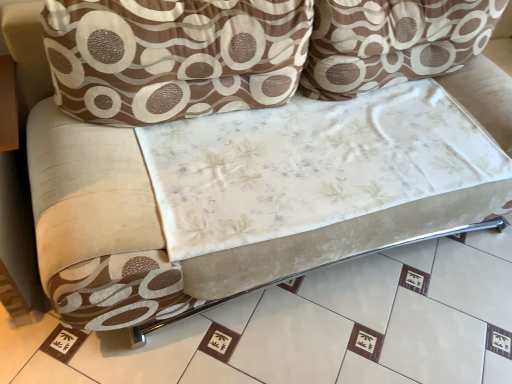
What is the approximate height of white fabric at center?

It is 2.30 inches.

I want to click on brown textured pillow at upper center, which is the 1th throw pillow from right to left, so click(392, 42).

From the image's perspective, which one is positioned higher, brown textured pillow at upper center, the first throw pillow in the left-to-right sequence, or brown textured pillow at upper center, which is the 1th throw pillow from right to left?

brown textured pillow at upper center, which is the 1th throw pillow from right to left, from the image's perspective.

Would you say brown textured pillow at upper center, which is the 1th throw pillow from right to left, is part of brown textured pillow at upper center, the first throw pillow in the left-to-right sequence,'s contents?

No, brown textured pillow at upper center, the first throw pillow in the left-to-right sequence, does not contain brown textured pillow at upper center, which is the 1th throw pillow from right to left.

I want to click on throw pillow that appears above the brown textured pillow at upper center, the 2th throw pillow viewed from the left (from a real-world perspective), so click(x=173, y=56).

Consider the image. Considering the sizes of objects brown textured pillow at upper center, placed as the second throw pillow when sorted from right to left, and brown textured pillow at upper center, which is the 1th throw pillow from right to left, in the image provided, who is shorter, brown textured pillow at upper center, placed as the second throw pillow when sorted from right to left, or brown textured pillow at upper center, which is the 1th throw pillow from right to left,?

Standing shorter between the two is brown textured pillow at upper center, which is the 1th throw pillow from right to left.

Based on the photo, from the image's perspective, who appears lower, white fabric at center or brown textured pillow at upper center, placed as the second throw pillow when sorted from right to left?

white fabric at center is shown below in the image.

Which is correct: white fabric at center is inside brown textured pillow at upper center, the first throw pillow in the left-to-right sequence, or outside of it?

white fabric at center is not enclosed by brown textured pillow at upper center, the first throw pillow in the left-to-right sequence.

Is point (63, 380) more distant than point (167, 4)?

Yes, point (63, 380) is farther from viewer.

Does white fabric at center turn towards brown textured pillow at upper center, placed as the second throw pillow when sorted from right to left?

No, white fabric at center is not oriented towards brown textured pillow at upper center, placed as the second throw pillow when sorted from right to left.

What's the angular difference between white fabric at center and brown textured pillow at upper center, which is the 1th throw pillow from right to left,'s facing directions?

The angle between the facing direction of white fabric at center and the facing direction of brown textured pillow at upper center, which is the 1th throw pillow from right to left, is 90 degrees.

From the image's perspective, which one is positioned lower, white fabric at center or brown textured pillow at upper center, the 2th throw pillow viewed from the left?

From the image's view, white fabric at center is below.

Can we say white fabric at center lies outside brown textured pillow at upper center, the 2th throw pillow viewed from the left?

white fabric at center lies outside brown textured pillow at upper center, the 2th throw pillow viewed from the left,'s area.

Who is bigger, white fabric at center or brown textured pillow at upper center, the 2th throw pillow viewed from the left?

Bigger between the two is white fabric at center.

From a real-world perspective, between brown textured pillow at upper center, which is the 1th throw pillow from right to left, and white fabric at center, who is vertically higher?

In real-world perspective, brown textured pillow at upper center, which is the 1th throw pillow from right to left, is above.

Consider the image. Is brown textured pillow at upper center, which is the 1th throw pillow from right to left, taller than white fabric at center?

Yes, brown textured pillow at upper center, which is the 1th throw pillow from right to left, is taller than white fabric at center.

Are brown textured pillow at upper center, which is the 1th throw pillow from right to left, and white fabric at center located far from each other?

brown textured pillow at upper center, which is the 1th throw pillow from right to left, is actually quite close to white fabric at center.

Where is `tile that appears in front of the brown textured pillow at upper center, which is the 1th throw pillow from right to left`? tile that appears in front of the brown textured pillow at upper center, which is the 1th throw pillow from right to left is located at coordinates (314, 327).

From the image's perspective, is brown textured pillow at upper center, which is the 1th throw pillow from right to left, located beneath brown textured pillow at upper center, placed as the second throw pillow when sorted from right to left?

No, from the image's perspective, brown textured pillow at upper center, which is the 1th throw pillow from right to left, is not below brown textured pillow at upper center, placed as the second throw pillow when sorted from right to left.

Image resolution: width=512 pixels, height=384 pixels. Find the location of `throw pillow lying behind the brown textured pillow at upper center, the first throw pillow in the left-to-right sequence`. throw pillow lying behind the brown textured pillow at upper center, the first throw pillow in the left-to-right sequence is located at coordinates (392, 42).

Would you say brown textured pillow at upper center, the 2th throw pillow viewed from the left, is outside brown textured pillow at upper center, the first throw pillow in the left-to-right sequence?

brown textured pillow at upper center, the 2th throw pillow viewed from the left, lies outside brown textured pillow at upper center, the first throw pillow in the left-to-right sequence,'s area.

Looking at this image, measure the distance from brown textured pillow at upper center, the first throw pillow in the left-to-right sequence, to white fabric at center.

A distance of 33.62 inches exists between brown textured pillow at upper center, the first throw pillow in the left-to-right sequence, and white fabric at center.

This screenshot has height=384, width=512. I want to click on the 2nd throw pillow directly above the white fabric at center (from a real-world perspective), so click(173, 56).

Between point (214, 87) and point (439, 305), which one is positioned behind?

The point (439, 305) is more distant.

Looking at this image, between brown textured pillow at upper center, the first throw pillow in the left-to-right sequence, and white fabric at center, which one has larger width?

white fabric at center is wider.

Identify the location of throw pillow that is in front of the brown textured pillow at upper center, which is the 1th throw pillow from right to left. The image size is (512, 384). (173, 56).

I want to click on the 1st throw pillow positioned above the white fabric at center (from the image's perspective), so click(x=173, y=56).

Considering their positions, is white fabric at center positioned closer to brown textured pillow at upper center, placed as the second throw pillow when sorted from right to left, than brown textured pillow at upper center, the 2th throw pillow viewed from the left?

Based on the image, brown textured pillow at upper center, the 2th throw pillow viewed from the left, appears to be nearer to brown textured pillow at upper center, placed as the second throw pillow when sorted from right to left.

Looking at the image, which one is located closer to brown textured pillow at upper center, placed as the second throw pillow when sorted from right to left, brown textured pillow at upper center, which is the 1th throw pillow from right to left, or white fabric at center?

The object closer to brown textured pillow at upper center, placed as the second throw pillow when sorted from right to left, is brown textured pillow at upper center, which is the 1th throw pillow from right to left.

From the image, which object appears to be farther from white fabric at center, brown textured pillow at upper center, the first throw pillow in the left-to-right sequence, or brown textured pillow at upper center, the 2th throw pillow viewed from the left?

brown textured pillow at upper center, the 2th throw pillow viewed from the left, is positioned further to the anchor white fabric at center.

In the scene shown: Considering their positions, is brown textured pillow at upper center, placed as the second throw pillow when sorted from right to left, positioned closer to brown textured pillow at upper center, which is the 1th throw pillow from right to left, than white fabric at center?

brown textured pillow at upper center, placed as the second throw pillow when sorted from right to left, is positioned closer to the anchor brown textured pillow at upper center, which is the 1th throw pillow from right to left.

Looking at the image, which one is located further to white fabric at center, brown textured pillow at upper center, which is the 1th throw pillow from right to left, or brown textured pillow at upper center, the first throw pillow in the left-to-right sequence?

brown textured pillow at upper center, which is the 1th throw pillow from right to left, is positioned further to the anchor white fabric at center.

Which object lies further to the anchor point brown textured pillow at upper center, the 2th throw pillow viewed from the left, white fabric at center or brown textured pillow at upper center, the first throw pillow in the left-to-right sequence?

The object further to brown textured pillow at upper center, the 2th throw pillow viewed from the left, is white fabric at center.

Where is `throw pillow between brown textured pillow at upper center, which is the 1th throw pillow from right to left, and white fabric at center, in the vertical direction`? This screenshot has width=512, height=384. throw pillow between brown textured pillow at upper center, which is the 1th throw pillow from right to left, and white fabric at center, in the vertical direction is located at coordinates coord(173,56).